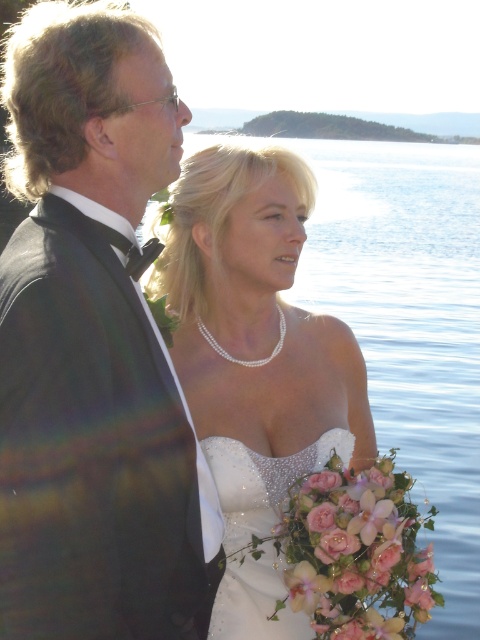
You are a photographer at the wedding and want to ensure both the pearl necklace at center and the sparkly white dress at center are in focus. The camera can focus on objects within a 15 inch range. Will both items be in focus?

The pearl necklace at center and the sparkly white dress at center are 16.22 inches apart, which exceeds the camera focus range of 15 inches. Therefore, both items cannot be in focus simultaneously.

You are a photographer at the wedding scene. You need to adjust the lighting to ensure both the shiny black tuxedo at left and the pearl necklace at center are well illuminated. Considering their sizes, which object requires a larger light source?

The shiny black tuxedo at left requires a larger light source because it is much taller than the pearl necklace at center.